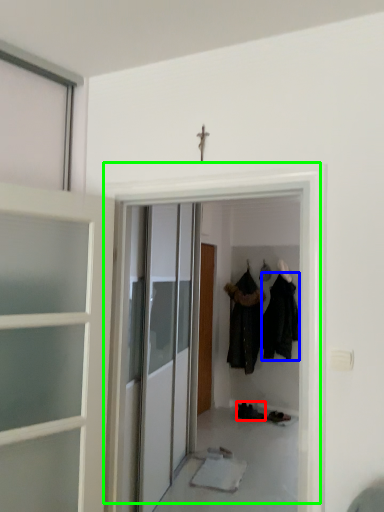
Question: Which object is the farthest from footwear (highlighted by a red box)? Choose among these: clothing (highlighted by a blue box) or door (highlighted by a green box).

Choices:
 (A) clothing
 (B) door

Answer: (B)